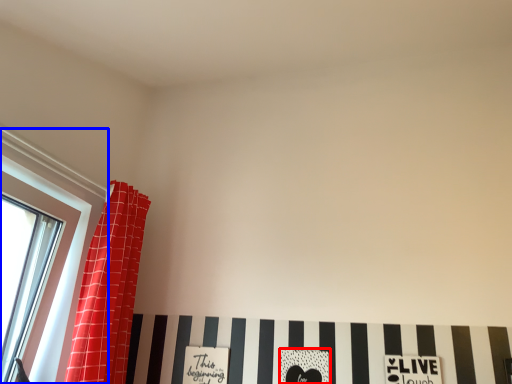
Question: Among these objects, which one is nearest to the camera, print (highlighted by a red box) or window (highlighted by a blue box)?

Choices:
 (A) print
 (B) window

Answer: (B)